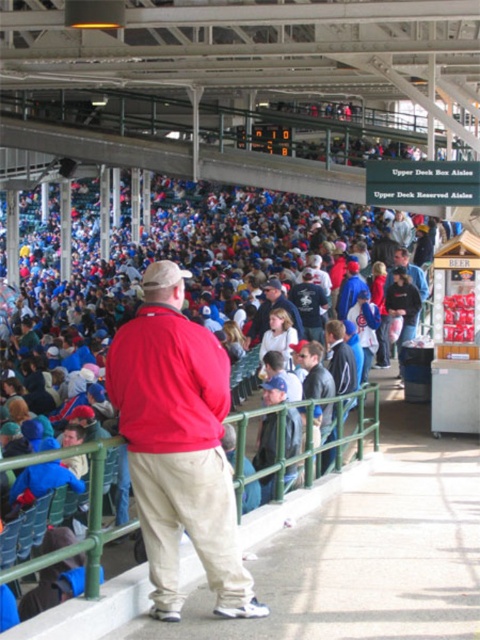
Is green metal railing at center positioned behind blue denim jeans at center?

No.

Between green metal railing at center and blue denim jeans at center, which one appears on the right side from the viewer's perspective?

blue denim jeans at center is more to the right.

You are a GUI agent. You are given a task and a screenshot of the screen. Output one action in this format:
    pyautogui.click(x=<x>, y=<y>)
    Task: Click on the green metal railing at center
    The width and height of the screenshot is (480, 640).
    Given the screenshot: What is the action you would take?
    pyautogui.click(x=92, y=611)

Between matte red jacket at center and blue denim jeans at center, which one has less height?

matte red jacket at center is shorter.

Is matte red jacket at center further to the viewer compared to blue denim jeans at center?

No, it is in front of blue denim jeans at center.

Which is behind, point (214, 413) or point (264, 488)?

The point (264, 488) is behind.

Locate an element on the screen. This screenshot has height=640, width=480. matte red jacket at center is located at coordinates (179, 444).

Which is below, blue denim jeans at center or dark gray jacket at center?

blue denim jeans at center is below.

Can you confirm if blue denim jeans at center is bigger than dark gray jacket at center?

Yes.

Where is `blue denim jeans at center`? blue denim jeans at center is located at coordinates (266, 442).

The width and height of the screenshot is (480, 640). Identify the location of blue denim jeans at center. (266, 442).